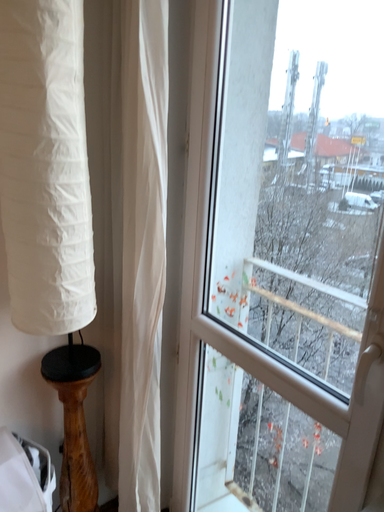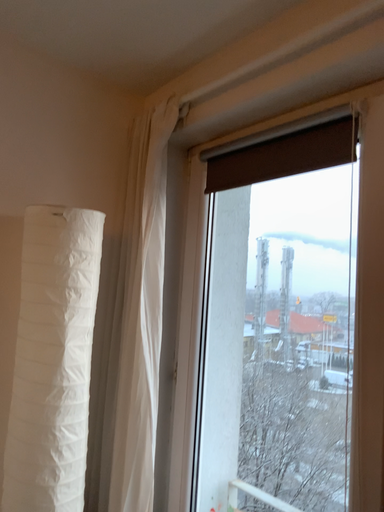
Question: How did the camera likely rotate when shooting the video?

Choices:
 (A) rotated upward
 (B) rotated downward

Answer: (A)